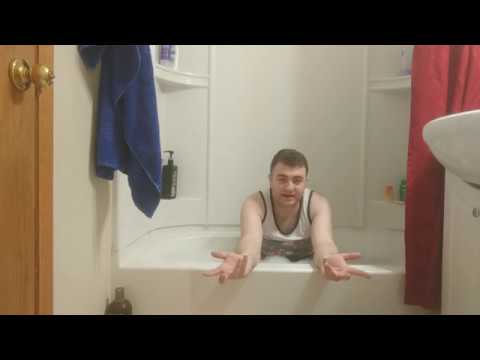
Where is `door knob`? This screenshot has width=480, height=360. door knob is located at coordinates coord(49,76).